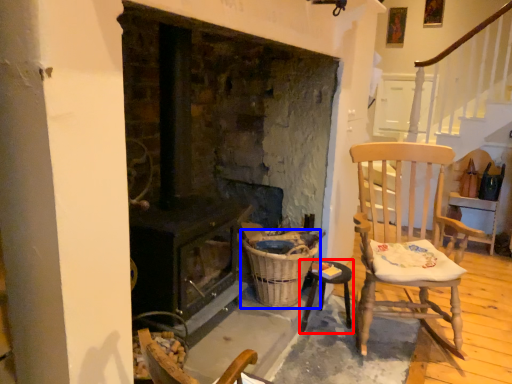
Question: Which object appears closest to the camera in this image, table (highlighted by a red box) or basket (highlighted by a blue box)?

Choices:
 (A) table
 (B) basket

Answer: (B)